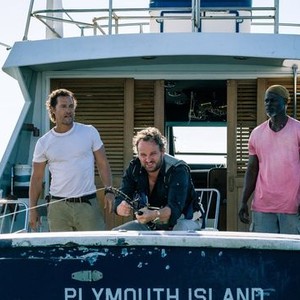
Find the location of a particular element. The image size is (300, 300). doors is located at coordinates (126, 101), (234, 184).